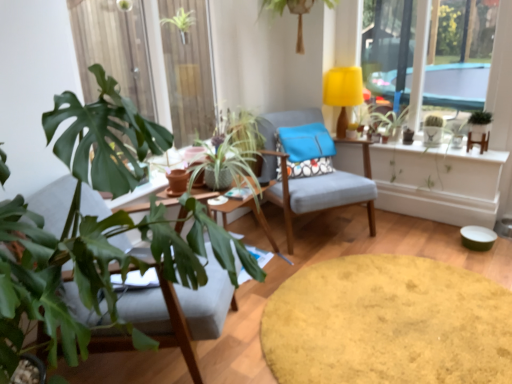
Describe the element at coordinates (114, 49) in the screenshot. I see `green leafy plant at left` at that location.

The height and width of the screenshot is (384, 512). I want to click on blue fabric pillow at center, so click(x=306, y=149).

In order to face green leafy plant at upper center, marked as the 3th houseplant in a right-to-left arrangement, should I rotate leftwards or rightwards?

You should look right and rotate roughly 5.076 degrees.

Describe the element at coordinates (182, 310) in the screenshot. I see `matte gray chair at center, the second chair from the right` at that location.

Measure the distance between green leafy plant at upper center, the 1th houseplant in the left-to-right sequence, and camera.

green leafy plant at upper center, the 1th houseplant in the left-to-right sequence, and camera are 2.59 meters apart.

Where is `wooden round table at center, the second round table ordered from the bottom`? This screenshot has width=512, height=384. wooden round table at center, the second round table ordered from the bottom is located at coordinates (260, 221).

What is the approximate width of green matte plant at right, acting as the first houseplant starting from the right?

green matte plant at right, acting as the first houseplant starting from the right, is 3.26 inches in width.

Locate an element on the screen. green leafy plant at center, arranged as the 2th houseplant when viewed from the left is located at coordinates (233, 149).

Is matte gray chair at center, which is the first chair in right-to-left order, far from green leafy plant at left?

Yes, matte gray chair at center, which is the first chair in right-to-left order, and green leafy plant at left are quite far apart.

Is point (290, 236) less distant than point (137, 1)?

Yes, it is.

How many degrees apart are the facing directions of matte gray chair at center, positioned as the 2th chair in left-to-right order, and green leafy plant at left?

There is a 35.8-degree angle between the facing directions of matte gray chair at center, positioned as the 2th chair in left-to-right order, and green leafy plant at left.

The image size is (512, 384). Find the location of `window frame above the matte gray chair at center, placed as the first chair when sorted from back to front (from the image's perspective)`. window frame above the matte gray chair at center, placed as the first chair when sorted from back to front (from the image's perspective) is located at coordinates (114, 49).

Is green leafy plant at left surrounded by yellow fabric lampshade at upper center?

No, green leafy plant at left is not a part of yellow fabric lampshade at upper center.

Which object is wider, yellow fabric lampshade at upper center or green leafy plant at left?

green leafy plant at left is wider.

Which object is further away from the camera, yellow fabric lampshade at upper center or green leafy plant at left?

yellow fabric lampshade at upper center is behind.

Which is in front, point (341, 134) or point (212, 97)?

Positioned in front is point (212, 97).

Is there a large distance between wooden round table at center, the second round table ordered from the bottom, and green leafy plant at center, arranged as the 2th houseplant when viewed from the left?

wooden round table at center, the second round table ordered from the bottom, is actually quite close to green leafy plant at center, arranged as the 2th houseplant when viewed from the left.

Does point (269, 228) lie in front of point (254, 169)?

No, (269, 228) is behind (254, 169).

In the scene shown: Based on their sizes in the image, would you say wooden round table at center, the 1th round table in the top-to-bottom sequence, is bigger or smaller than green leafy plant at center, arranged as the 2th houseplant when viewed from the left?

wooden round table at center, the 1th round table in the top-to-bottom sequence, is bigger than green leafy plant at center, arranged as the 2th houseplant when viewed from the left.

From the image's perspective, does wooden round table at center, the second round table ordered from the bottom, appear higher than green leafy plant at center, the fourth houseplant when ordered from right to left?

No, from the image's perspective, wooden round table at center, the second round table ordered from the bottom, is not over green leafy plant at center, the fourth houseplant when ordered from right to left.

Based on the photo, can you tell me how much green leafy plant at upper center, which appears as the third houseplant when viewed from the left, and green matte plant at right, acting as the first houseplant starting from the right, differ in facing direction?

green leafy plant at upper center, which appears as the third houseplant when viewed from the left, and green matte plant at right, acting as the first houseplant starting from the right, are facing 2.12 degrees away from each other.

Considering the sizes of objects green leafy plant at upper center, which appears as the third houseplant when viewed from the left, and green matte plant at right, which is counted as the fifth houseplant, starting from the left, in the image provided, who is shorter, green leafy plant at upper center, which appears as the third houseplant when viewed from the left, or green matte plant at right, which is counted as the fifth houseplant, starting from the left,?

green matte plant at right, which is counted as the fifth houseplant, starting from the left.

Does point (293, 9) come farther from viewer compared to point (482, 122)?

Yes.

Looking at this image, which object is further away from the camera taking this photo, green leafy plant at center, arranged as the 2th houseplant when viewed from the left, or yellow fabric lampshade at upper right?

green leafy plant at center, arranged as the 2th houseplant when viewed from the left, is more distant.

Is green leafy plant at center, arranged as the 2th houseplant when viewed from the left, inside or outside of yellow fabric lampshade at upper right?

green leafy plant at center, arranged as the 2th houseplant when viewed from the left, exists outside the volume of yellow fabric lampshade at upper right.

Is point (228, 164) positioned after point (440, 29)?

That is False.

Measure the distance from green leafy plant at center, arranged as the 2th houseplant when viewed from the left, to yellow fabric lampshade at upper right.

green leafy plant at center, arranged as the 2th houseplant when viewed from the left, and yellow fabric lampshade at upper right are 4.02 feet apart.

How different are the orientations of yellow fabric lampshade at upper right and green leafy plant at center, the fourth houseplant when ordered from right to left, in degrees?

yellow fabric lampshade at upper right and green leafy plant at center, the fourth houseplant when ordered from right to left, are facing 90.7 degrees away from each other.

Can you confirm if yellow fabric lampshade at upper right is positioned to the left of green leafy plant at center, arranged as the 2th houseplant when viewed from the left?

Incorrect, yellow fabric lampshade at upper right is not on the left side of green leafy plant at center, arranged as the 2th houseplant when viewed from the left.

Would you say yellow fabric lampshade at upper right is a long distance from green leafy plant at center, the fourth houseplant when ordered from right to left?

Yes.

Find the location of `window above the green leafy plant at center, the fourth houseplant when ordered from right to left (from the image's perspective)`. window above the green leafy plant at center, the fourth houseplant when ordered from right to left (from the image's perspective) is located at coordinates (389, 44).

Is green matte cactus at upper right, which ranks as the second houseplant in right-to-left order, oriented towards white glossy shelf at upper center?

No, green matte cactus at upper right, which ranks as the second houseplant in right-to-left order, is not facing towards white glossy shelf at upper center.

Considering the sizes of green matte cactus at upper right, which ranks as the second houseplant in right-to-left order, and white glossy shelf at upper center in the image, is green matte cactus at upper right, which ranks as the second houseplant in right-to-left order, wider or thinner than white glossy shelf at upper center?

In the image, green matte cactus at upper right, which ranks as the second houseplant in right-to-left order, appears to be more narrow than white glossy shelf at upper center.

In the image, is green matte cactus at upper right, which is counted as the fourth houseplant, starting from the left, on the left side or the right side of white glossy shelf at upper center?

Clearly, green matte cactus at upper right, which is counted as the fourth houseplant, starting from the left, is on the right of white glossy shelf at upper center in the image.

Considering the points (429, 126) and (440, 145), which point is behind, point (429, 126) or point (440, 145)?

The point (429, 126) is more distant.

Where is `the 2nd chair to the right when counting from the green leafy plant at left`? This screenshot has height=384, width=512. the 2nd chair to the right when counting from the green leafy plant at left is located at coordinates (312, 177).

The height and width of the screenshot is (384, 512). In order to click on window frame above the yellow fabric lampshade at upper center (from a real-world perspective) in this screenshot , I will do `click(114, 49)`.

Which object lies further to the anchor point white glossy shelf at upper center, green matte plant at right, acting as the first houseplant starting from the right, or yellow fabric lampshade at upper center?

yellow fabric lampshade at upper center lies further to white glossy shelf at upper center than the other object.

Which object lies further to the anchor point green matte plant at upper right, wooden round table at center, the 1th round table in the top-to-bottom sequence, or matte gray chair at center, which is counted as the 2th chair, starting from the front?

Among the two, wooden round table at center, the 1th round table in the top-to-bottom sequence, is located further to green matte plant at upper right.

Looking at the image, which one is located further to green leafy plant at left, velvet yellow rug at center, placed as the 2th round table when sorted from top to bottom, or green leafy plant at upper center, the 5th houseplant in the right-to-left sequence?

The object further to green leafy plant at left is velvet yellow rug at center, placed as the 2th round table when sorted from top to bottom.

From the image, which object appears to be farther from velvet yellow rug at center, the first round table positioned from the bottom, white glossy shelf at upper center or green matte plant at upper right?

green matte plant at upper right lies further to velvet yellow rug at center, the first round table positioned from the bottom, than the other object.

Estimate the real-world distances between objects in this image. Which object is closer to green leafy plant at left, green matte cactus at upper right, which is counted as the fourth houseplant, starting from the left, or yellow fabric lampshade at upper center?

yellow fabric lampshade at upper center lies closer to green leafy plant at left than the other object.

Based on their spatial positions, is matte gray chair at center, positioned as the 2th chair in left-to-right order, or green leafy plant at upper center, the 1th houseplant in the left-to-right sequence, further from green matte plant at right, acting as the first houseplant starting from the right?

green leafy plant at upper center, the 1th houseplant in the left-to-right sequence, lies further to green matte plant at right, acting as the first houseplant starting from the right, than the other object.

Which object lies nearer to the anchor point green matte plant at right, acting as the first houseplant starting from the right, green leafy plant at upper center, marked as the 3th houseplant in a right-to-left arrangement, or velvet yellow rug at center, the first round table positioned from the bottom?

green leafy plant at upper center, marked as the 3th houseplant in a right-to-left arrangement.

From the image, which object appears to be farther from green leafy plant at left, green matte plant at upper right or green leafy plant at upper center, marked as the 3th houseplant in a right-to-left arrangement?

green matte plant at upper right is positioned further to the anchor green leafy plant at left.

Where is `pillow positioned between velvet yellow rug at center, placed as the 2th round table when sorted from top to bottom, and yellow fabric lampshade at upper center from near to far`? This screenshot has height=384, width=512. pillow positioned between velvet yellow rug at center, placed as the 2th round table when sorted from top to bottom, and yellow fabric lampshade at upper center from near to far is located at coordinates (306, 149).

The image size is (512, 384). What are the coordinates of `pillow between green leafy plant at upper center, the 5th houseplant in the right-to-left sequence, and green matte plant at upper right, in the horizontal direction` in the screenshot? It's located at (306, 149).

This screenshot has width=512, height=384. I want to click on lamp located between green leafy plant at center, arranged as the 2th houseplant when viewed from the left, and green matte plant at upper right in the left-right direction, so click(343, 92).

Find the location of `chair that lies between green leafy plant at upper center, the 1th houseplant in the left-to-right sequence, and matte gray chair at center, the second chair from the right, from top to bottom`. chair that lies between green leafy plant at upper center, the 1th houseplant in the left-to-right sequence, and matte gray chair at center, the second chair from the right, from top to bottom is located at coordinates (312, 177).